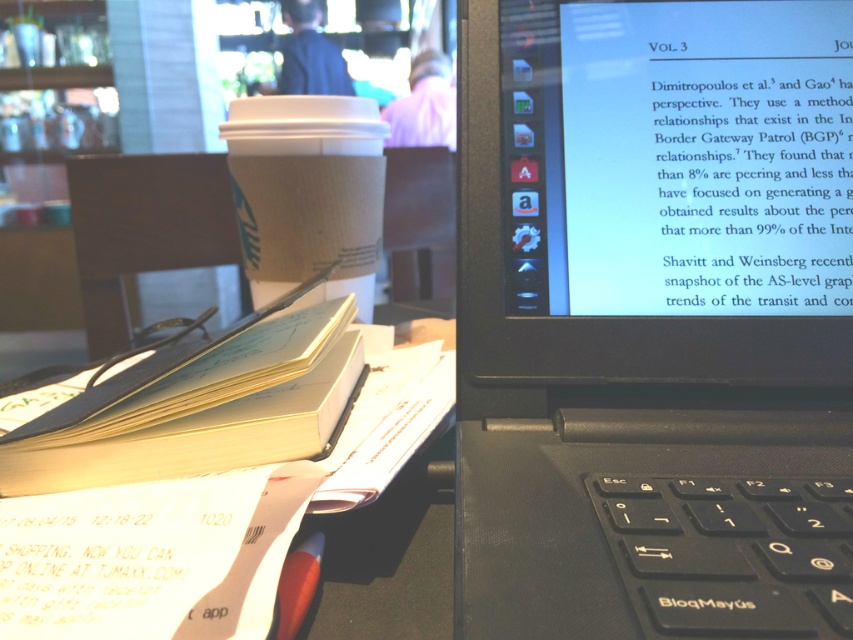
Can you confirm if black matte laptop at center is thinner than yellow paper notebook at center?

In fact, black matte laptop at center might be wider than yellow paper notebook at center.

At what (x,y) coordinates should I click in order to perform the action: click on black matte laptop at center. Please return your answer as a coordinate pair (x, y). Looking at the image, I should click on [654, 320].

Locate an element on the screen. The height and width of the screenshot is (640, 853). black matte laptop at center is located at coordinates (654, 320).

Between matte black screen at upper right and yellow paper notebook at center, which one is positioned lower?

yellow paper notebook at center is below.

This screenshot has height=640, width=853. What do you see at coordinates (676, 157) in the screenshot?
I see `matte black screen at upper right` at bounding box center [676, 157].

This screenshot has width=853, height=640. I want to click on matte black screen at upper right, so [676, 157].

Which is behind, point (770, 163) or point (361, 257)?

Positioned behind is point (361, 257).

Which is in front, point (573, 584) or point (303, 300)?

Positioned in front is point (573, 584).

The image size is (853, 640). Identify the location of black matte laptop at center. (654, 320).